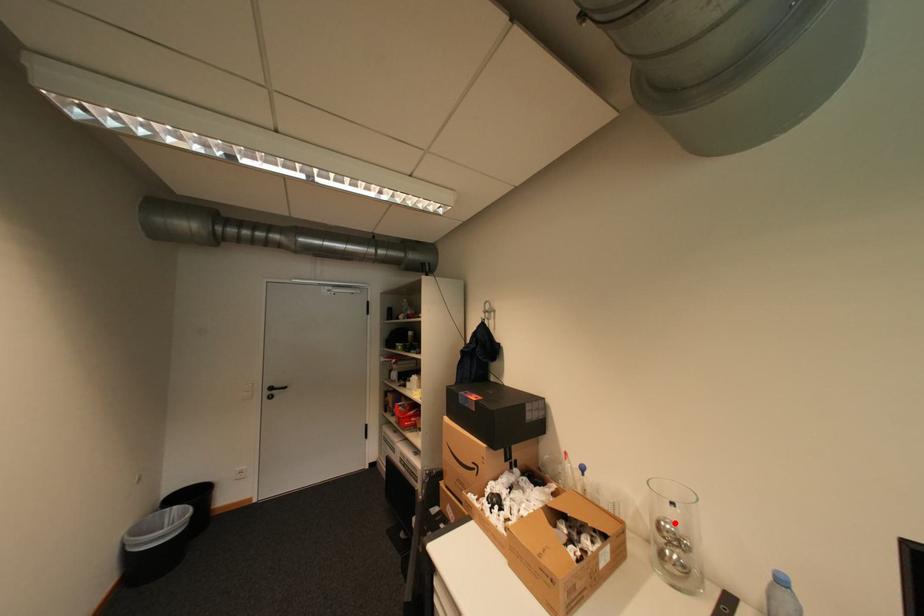
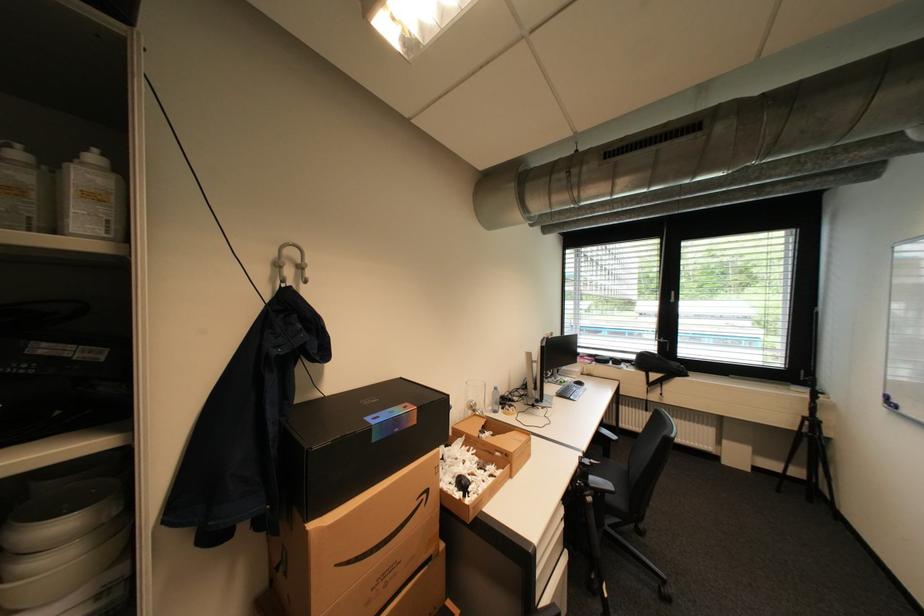
Locate, in the second image, the point that corresponds to the highlighted location in the first image.

(480, 402)